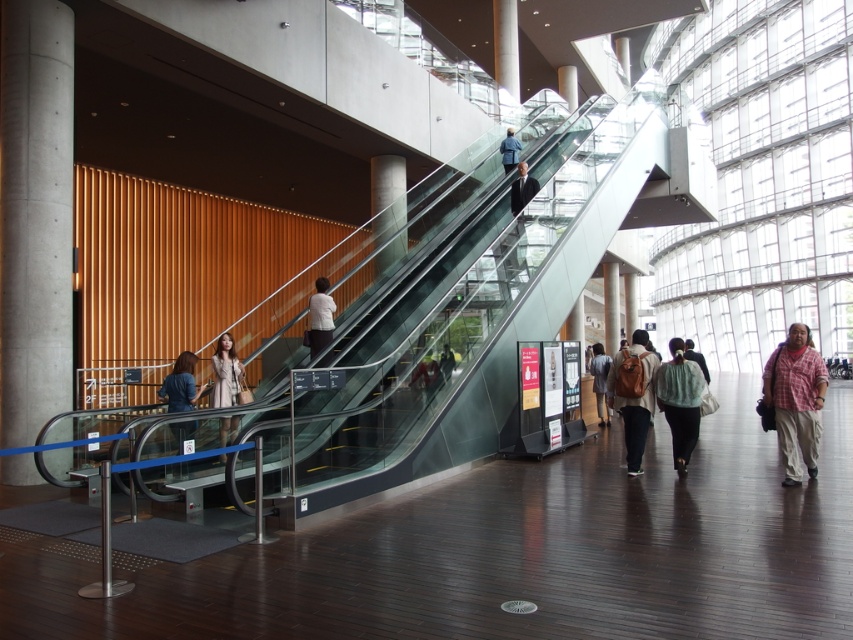
Question: Which point is closer to the camera?

Choices:
 (A) concrete at left
 (B) matte black jacket at lower left
 (C) light blue fabric bag at center
 (D) matte brown backpack at center

Answer: (B)

Question: Does light brown fabric coat at lower left have a lesser width compared to black suit at upper center?

Choices:
 (A) yes
 (B) no

Answer: (A)

Question: Which point appears farthest from the camera in this image?

Choices:
 (A) (163, 392)
 (B) (532, 193)

Answer: (B)

Question: Estimate the real-world distances between objects in this image. Which object is farther from the matte black jacket at lower left?

Choices:
 (A) light brown fabric jacket at center
 (B) black suit at upper center

Answer: (A)

Question: Where is matte brown backpack at center located in relation to light blue fabric bag at center in the image?

Choices:
 (A) left
 (B) right

Answer: (A)

Question: Where is light brown fabric coat at lower left located in relation to white shirt at center in the image?

Choices:
 (A) left
 (B) right

Answer: (A)